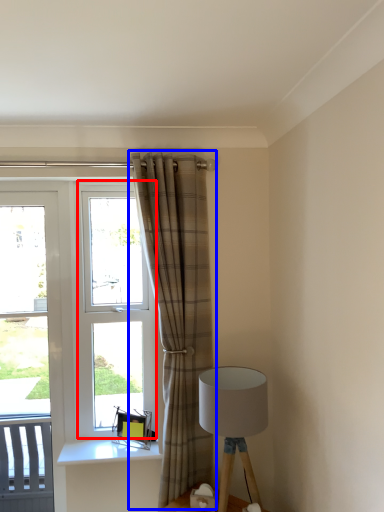
Question: Which of the following is the farthest to the observer, window (highlighted by a red box) or curtain (highlighted by a blue box)?

Choices:
 (A) window
 (B) curtain

Answer: (A)